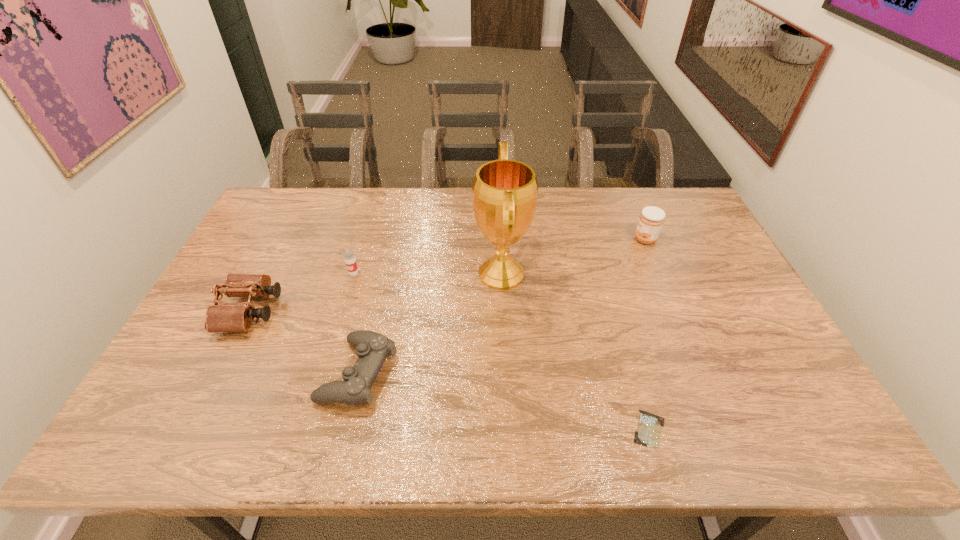
The width and height of the screenshot is (960, 540). Find the location of `object positioned at the left edge`. object positioned at the left edge is located at coordinates (229, 317).

The image size is (960, 540). Find the location of `vacant point at the far edge`. vacant point at the far edge is located at coordinates (584, 204).

Where is `free space at the near edge of the desktop`? free space at the near edge of the desktop is located at coordinates (471, 415).

Identify the location of free space at the left edge of the desktop. (287, 251).

Where is `vacant space at the far left corner of the desktop`? vacant space at the far left corner of the desktop is located at coordinates (303, 193).

The image size is (960, 540). Identify the location of vacant area at the far right corner. (641, 190).

Locate an element on the screen. empty space between the binoculars and the tallest object is located at coordinates (375, 293).

This screenshot has height=540, width=960. Identify the location of unoccupied area between the second object from right to left and the fifth tallest object. (503, 401).

Identify the location of free space between the shortest object and the leftmost object. (449, 370).

Image resolution: width=960 pixels, height=540 pixels. In order to click on free spot between the control and the leftmost object in this screenshot , I will do `click(304, 342)`.